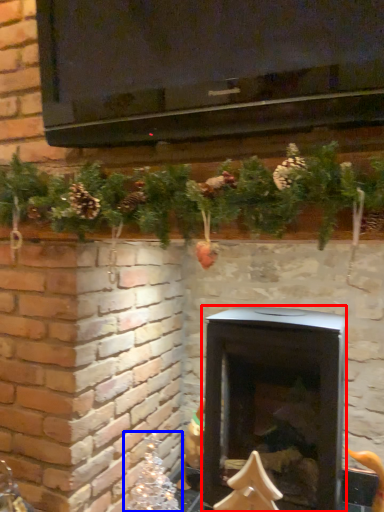
Question: Which object is closer to the camera taking this photo, wood burning stove (highlighted by a red box) or christmas decoration (highlighted by a blue box)?

Choices:
 (A) wood burning stove
 (B) christmas decoration

Answer: (A)